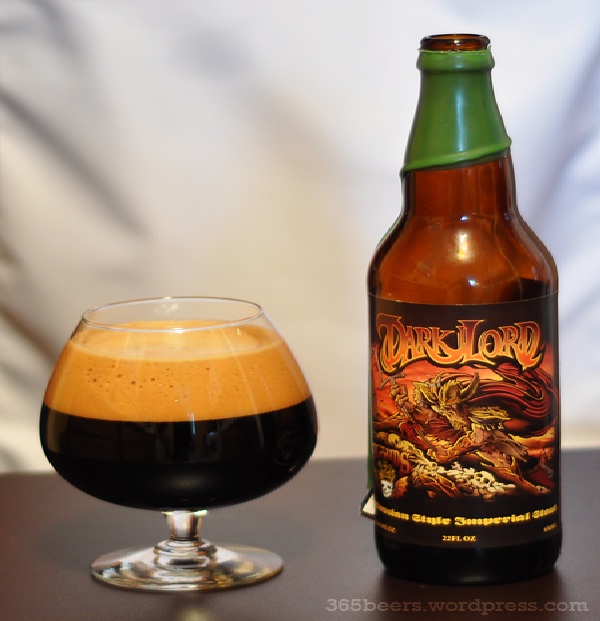
Find the location of a particular element. This screenshot has width=600, height=621. stem of glass is located at coordinates (174, 530).